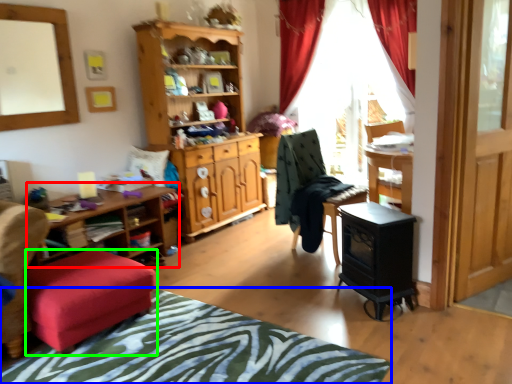
Question: Which object is the closest to the table (highlighted by a red box)? Choose among these: bedcover (highlighted by a blue box) or stool (highlighted by a green box).

Choices:
 (A) bedcover
 (B) stool

Answer: (B)